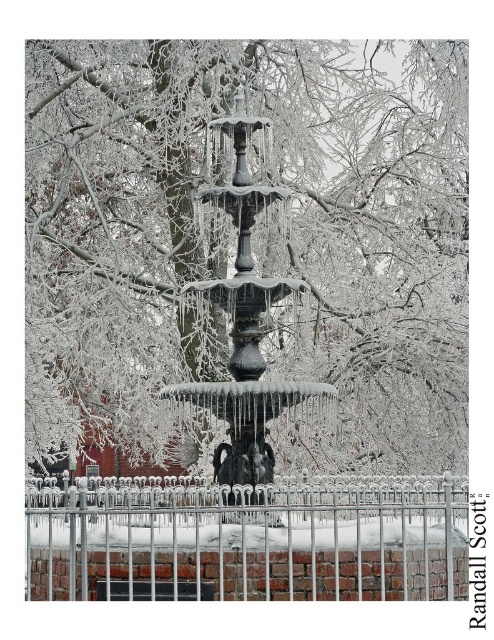
You are an artist planning to paint this winter scene. You want to ensure the white frosted branches at center and the polished bronze fountain at center are proportionally accurate. Based on the scene, which object should appear taller in your painting?

The white frosted branches at center should appear taller in the painting since they are taller than the polished bronze fountain at center according to the description.

You are standing in the winter scene and see the ornate fountain encased in ice. There is a point marked at coordinates (242, 253). What object is located at this point?

The point at coordinates (242, 253) marks the location of white frosted branches at center.

You are a photographer trying to capture the polished bronze fountain at center without the white metal fence at lower center appearing in the foreground. Based on their heights, is this possible?

The white metal fence at lower center has a lesser height compared to the polished bronze fountain at center. Therefore, it is possible to position yourself so that the taller fountain obscures the shorter fence from view, preventing it from appearing in the foreground.